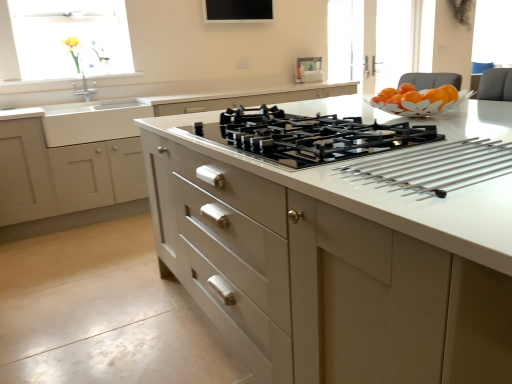
Question: From a real-world perspective, is translucent glass window at upper left physically located above or below white glossy sink at left?

Choices:
 (A) above
 (B) below

Answer: (A)

Question: Is translucent glass window at upper left bigger or smaller than white glossy sink at left?

Choices:
 (A) big
 (B) small

Answer: (B)

Question: Which object is positioned farthest from the black glass tv at upper center?

Choices:
 (A) translucent glass window at upper left
 (B) white glossy sink at left
 (C) black glass gas stove at center
 (D) yellow matte flower at upper left
 (E) white glossy countertop at center

Answer: (E)

Question: Which of these objects is positioned closest to the yellow matte flower at upper left?

Choices:
 (A) white glossy countertop at center
 (B) white glossy sink at left
 (C) black glass gas stove at center
 (D) matte white drawers at center
 (E) black glass tv at upper center

Answer: (B)